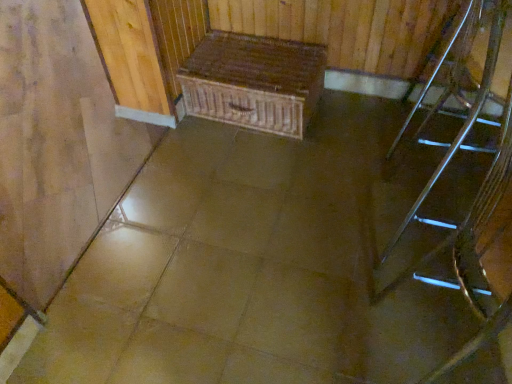
Identify the location of metallic silver stairs at right. (433, 180).

What is the approximate height of metallic silver chair at right?

The height of metallic silver chair at right is 27.60 inches.

Find the location of a particular element. metallic silver stairs at right is located at coordinates (433, 180).

Can you tell me how much metallic silver stairs at right and metallic silver chair at right differ in facing direction?

2.23 degrees.

Considering the points (459, 143) and (400, 132), which point is behind, point (459, 143) or point (400, 132)?

The point (400, 132) is behind.

From the image's perspective, which one is positioned higher, metallic silver stairs at right or metallic silver chair at right?

metallic silver chair at right, from the image's perspective.

In the scene shown: Which of these two, metallic silver stairs at right or metallic silver chair at right, stands shorter?

metallic silver chair at right is shorter.

Based on the photo, is metallic silver chair at right beside metallic silver stairs at right?

No, metallic silver chair at right is not in contact with metallic silver stairs at right.

Is metallic silver chair at right to the right of metallic silver stairs at right from the viewer's perspective?

Yes, metallic silver chair at right is to the right of metallic silver stairs at right.

Can you tell me how much metallic silver chair at right and metallic silver stairs at right differ in facing direction?

They differ by 2.23 degrees in their facing directions.

Is metallic silver stairs at right inside metallic silver chair at right?

Actually, metallic silver stairs at right is outside metallic silver chair at right.

The height and width of the screenshot is (384, 512). I want to click on furniture on the left side of metallic silver stairs at right, so click(x=253, y=82).

How far apart are wooden chest at center and metallic silver stairs at right?

A distance of 34.64 inches exists between wooden chest at center and metallic silver stairs at right.

Is wooden chest at center bigger than metallic silver stairs at right?

No.

Which object is positioned more to the left, wooden chest at center or metallic silver stairs at right?

From the viewer's perspective, wooden chest at center appears more on the left side.

Is metallic silver stairs at right oriented towards wooden chest at center?

No, metallic silver stairs at right does not turn towards wooden chest at center.

Can you see metallic silver stairs at right touching wooden chest at center?

No, metallic silver stairs at right is not touching wooden chest at center.

Which of these two, metallic silver stairs at right or wooden chest at center, stands shorter?

With less height is wooden chest at center.

Is wooden chest at center in contact with metallic silver chair at right?

No, wooden chest at center is not beside metallic silver chair at right.

Based on their positions, is wooden chest at center located to the left or right of metallic silver chair at right?

wooden chest at center is positioned on metallic silver chair at right's left side.

Which object is wider, wooden chest at center or metallic silver chair at right?

Wider between the two is metallic silver chair at right.

From a real-world perspective, is wooden chest at center positioned over metallic silver chair at right based on gravity?

No, from a real-world perspective, wooden chest at center is not above metallic silver chair at right.

Which object is wider, metallic silver chair at right or wooden chest at center?

metallic silver chair at right is wider.

Is the surface of metallic silver chair at right in direct contact with wooden chest at center?

No, metallic silver chair at right is not making contact with wooden chest at center.

Which object is further away from the camera, metallic silver chair at right or wooden chest at center?

wooden chest at center is behind.

Could you tell me if metallic silver chair at right is turned towards wooden chest at center?

No, metallic silver chair at right is not aimed at wooden chest at center.

This screenshot has height=384, width=512. What are the coordinates of `stairs above the metallic silver chair at right (from a real-world perspective)` in the screenshot? It's located at (433, 180).

Locate an element on the screen. chair behind the metallic silver stairs at right is located at coordinates (468, 72).

When comparing their distances from metallic silver stairs at right, does metallic silver chair at right or wooden chest at center seem further?

The object further to metallic silver stairs at right is wooden chest at center.

Considering their positions, is metallic silver stairs at right positioned closer to wooden chest at center than metallic silver chair at right?

The object closer to wooden chest at center is metallic silver chair at right.

Estimate the real-world distances between objects in this image. Which object is further from wooden chest at center, metallic silver chair at right or metallic silver stairs at right?

metallic silver stairs at right is further to wooden chest at center.

Considering their positions, is wooden chest at center positioned closer to metallic silver stairs at right than metallic silver chair at right?

The object closer to metallic silver stairs at right is metallic silver chair at right.

Considering their positions, is metallic silver stairs at right positioned closer to metallic silver chair at right than wooden chest at center?

Among the two, metallic silver stairs at right is located nearer to metallic silver chair at right.

Estimate the real-world distances between objects in this image. Which object is further from metallic silver chair at right, wooden chest at center or metallic silver stairs at right?

Among the two, wooden chest at center is located further to metallic silver chair at right.

At what (x,y) coordinates should I click in order to perform the action: click on chair between metallic silver stairs at right and wooden chest at center in the front-back direction. Please return your answer as a coordinate pair (x, y). The image size is (512, 384). Looking at the image, I should click on (468, 72).